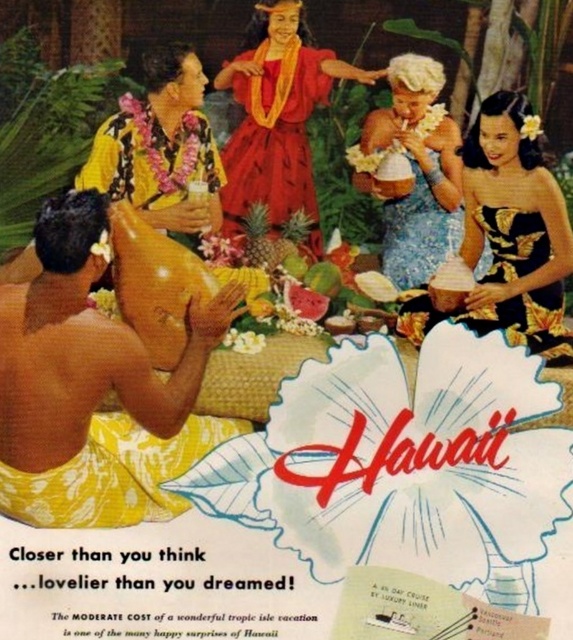
Is point (111, 436) farther from camera compared to point (203, 166)?

No, (111, 436) is closer to viewer.

What are the coordinates of `yellow woven cloth at left` in the screenshot? It's located at (95, 387).

Can you confirm if yellow woven cloth at left is positioned above black satin dress at center?

No, yellow woven cloth at left is not above black satin dress at center.

Image resolution: width=573 pixels, height=640 pixels. I want to click on yellow woven cloth at left, so tap(95, 387).

Which of these two, black satin dress at center or shiny red fabric dress at center, stands taller?

Standing taller between the two is black satin dress at center.

Which is more to the right, black satin dress at center or shiny red fabric dress at center?

black satin dress at center

Between point (535, 308) and point (238, 205), which one is positioned in front?

Point (535, 308)

Identify the location of black satin dress at center. (508, 236).